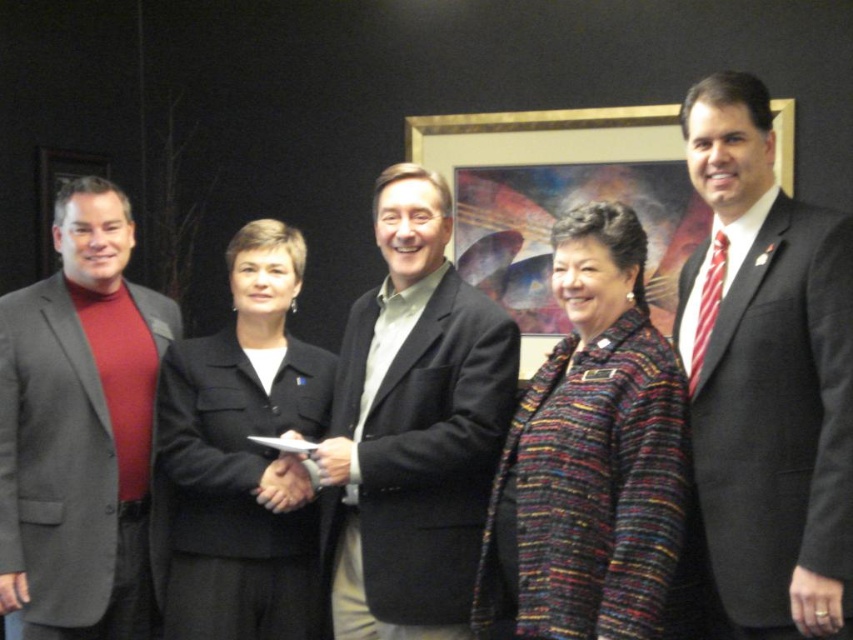
Does dark gray suit at center appear under matte gray blazer at left?

Actually, dark gray suit at center is above matte gray blazer at left.

Describe the element at coordinates (412, 428) in the screenshot. The height and width of the screenshot is (640, 853). I see `dark gray suit at center` at that location.

Who is more forward, (392, 612) or (73, 241)?

Point (392, 612) is more forward.

This screenshot has width=853, height=640. I want to click on dark gray suit at center, so click(412, 428).

Can you confirm if matte black suit at right is shorter than gold-framed picture at center?

In fact, matte black suit at right may be taller than gold-framed picture at center.

Which is below, matte black suit at right or gold-framed picture at center?

Positioned lower is matte black suit at right.

This screenshot has width=853, height=640. I want to click on matte black suit at right, so pos(767,374).

Identify the location of matte black suit at right. Image resolution: width=853 pixels, height=640 pixels. (767, 374).

Does multicolored tweed jacket at center lie behind black fabric coat at center?

No, multicolored tweed jacket at center is closer to the viewer.

Is point (599, 403) farther from viewer compared to point (277, 285)?

No, it is in front of (277, 285).

Which is behind, point (635, 404) or point (302, 636)?

Positioned behind is point (302, 636).

Find the location of a particular element. The width and height of the screenshot is (853, 640). multicolored tweed jacket at center is located at coordinates (590, 460).